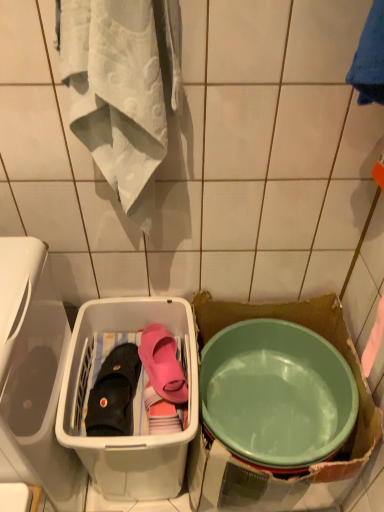
Based on the photo, what is the approximate width of green plastic bowl at lower right?

green plastic bowl at lower right is 18.17 inches wide.

What are the coordinates of `green plastic bowl at lower right` in the screenshot? It's located at (276, 394).

Locate an element on the screen. Image resolution: width=384 pixels, height=512 pixels. black fabric slipper at lower left, the 1th footwear when ordered from left to right is located at coordinates (114, 393).

Describe the element at coordinates (127, 436) in the screenshot. I see `translucent plastic basket at center` at that location.

Locate an element on the screen. The height and width of the screenshot is (512, 384). green plastic bowl at lower right is located at coordinates (276, 394).

Considering the relative sizes of translucent plastic basket at center and pink rubber slipper at center, placed as the 1th footwear when sorted from right to left, in the image provided, is translucent plastic basket at center wider than pink rubber slipper at center, placed as the 1th footwear when sorted from right to left,?

Yes.

Would you say translucent plastic basket at center is outside pink rubber slipper at center, placed as the 1th footwear when sorted from right to left?

Yes, translucent plastic basket at center is located beyond the bounds of pink rubber slipper at center, placed as the 1th footwear when sorted from right to left.

Is point (56, 435) farther from camera compared to point (170, 374)?

No, it is in front of (170, 374).

Consider the image. Is translucent plastic basket at center beside pink rubber slipper at center, which appears as the 2th footwear when viewed from the left?

There is a gap between translucent plastic basket at center and pink rubber slipper at center, which appears as the 2th footwear when viewed from the left.

Is translucent plastic basket at center surrounding black fabric slipper at lower left, positioned as the second footwear in right-to-left order?

Yes.

Would you consider translucent plastic basket at center to be distant from black fabric slipper at lower left, positioned as the second footwear in right-to-left order?

No, translucent plastic basket at center is in close proximity to black fabric slipper at lower left, positioned as the second footwear in right-to-left order.

Does point (161, 316) lie behind point (108, 424)?

Yes.

Consider the image. Which is more to the left, translucent plastic basket at center or black fabric slipper at lower left, the 1th footwear when ordered from left to right?

black fabric slipper at lower left, the 1th footwear when ordered from left to right.

Measure the distance between black fabric slipper at lower left, positioned as the second footwear in right-to-left order, and green plastic bowl at lower right.

black fabric slipper at lower left, positioned as the second footwear in right-to-left order, is 14.96 inches from green plastic bowl at lower right.

Can you confirm if black fabric slipper at lower left, positioned as the second footwear in right-to-left order, is wider than green plastic bowl at lower right?

No.

Between black fabric slipper at lower left, positioned as the second footwear in right-to-left order, and green plastic bowl at lower right, which one has larger size?

Bigger between the two is green plastic bowl at lower right.

Is black fabric slipper at lower left, the 1th footwear when ordered from left to right, at the right side of green plastic bowl at lower right?

No.

In terms of size, does green plastic bowl at lower right appear bigger or smaller than black fabric slipper at lower left, positioned as the second footwear in right-to-left order?

green plastic bowl at lower right is bigger than black fabric slipper at lower left, positioned as the second footwear in right-to-left order.

Is green plastic bowl at lower right next to black fabric slipper at lower left, positioned as the second footwear in right-to-left order, and touching it?

There is a gap between green plastic bowl at lower right and black fabric slipper at lower left, positioned as the second footwear in right-to-left order.

Measure the distance from pink rubber slipper at center, which appears as the 2th footwear when viewed from the left, to black fabric slipper at lower left, the 1th footwear when ordered from left to right.

They are 3.92 inches apart.

Would you say black fabric slipper at lower left, positioned as the second footwear in right-to-left order, is part of pink rubber slipper at center, which appears as the 2th footwear when viewed from the left,'s contents?

No, black fabric slipper at lower left, positioned as the second footwear in right-to-left order, is not inside pink rubber slipper at center, which appears as the 2th footwear when viewed from the left.

Is pink rubber slipper at center, placed as the 1th footwear when sorted from right to left, in front of black fabric slipper at lower left, the 1th footwear when ordered from left to right?

No.

Locate an element on the screen. footwear below the pink rubber slipper at center, placed as the 1th footwear when sorted from right to left (from the image's perspective) is located at coordinates (114, 393).

Between green plastic bowl at lower right and pink rubber slipper at center, which appears as the 2th footwear when viewed from the left, which one has larger size?

green plastic bowl at lower right is bigger.

Is green plastic bowl at lower right turned away from pink rubber slipper at center, which appears as the 2th footwear when viewed from the left?

No, green plastic bowl at lower right is not facing away from pink rubber slipper at center, which appears as the 2th footwear when viewed from the left.

Can you confirm if green plastic bowl at lower right is taller than pink rubber slipper at center, placed as the 1th footwear when sorted from right to left?

Yes.

The height and width of the screenshot is (512, 384). Identify the location of footwear that is the 2nd one when counting upward from the green plastic bowl at lower right (from the image's perspective). (163, 364).

Which is in front, green plastic bowl at lower right or translucent plastic basket at center?

translucent plastic basket at center.

Looking at the image, does green plastic bowl at lower right seem bigger or smaller compared to translucent plastic basket at center?

In the image, green plastic bowl at lower right appears to be smaller than translucent plastic basket at center.

Considering the sizes of green plastic bowl at lower right and translucent plastic basket at center in the image, is green plastic bowl at lower right wider or thinner than translucent plastic basket at center?

green plastic bowl at lower right is wider than translucent plastic basket at center.

Which is less distant, (305, 448) or (187, 318)?

Positioned in front is point (305, 448).

What are the coordinates of `footwear on the right side of translucent plastic basket at center` in the screenshot? It's located at (163, 364).

This screenshot has height=512, width=384. Find the location of `footwear that is the 1st one above the translucent plastic basket at center (from a real-world perspective)`. footwear that is the 1st one above the translucent plastic basket at center (from a real-world perspective) is located at coordinates (114, 393).

When comparing their distances from pink rubber slipper at center, which appears as the 2th footwear when viewed from the left, does translucent plastic basket at center or black fabric slipper at lower left, positioned as the second footwear in right-to-left order, seem further?

translucent plastic basket at center is positioned further to the anchor pink rubber slipper at center, which appears as the 2th footwear when viewed from the left.

From the image, which object appears to be farther from green plastic bowl at lower right, translucent plastic basket at center or black fabric slipper at lower left, the 1th footwear when ordered from left to right?

black fabric slipper at lower left, the 1th footwear when ordered from left to right, lies further to green plastic bowl at lower right than the other object.

Considering their positions, is black fabric slipper at lower left, the 1th footwear when ordered from left to right, positioned further to pink rubber slipper at center, which appears as the 2th footwear when viewed from the left, than translucent plastic basket at center?

translucent plastic basket at center lies further to pink rubber slipper at center, which appears as the 2th footwear when viewed from the left, than the other object.

Looking at the image, which one is located closer to pink rubber slipper at center, which appears as the 2th footwear when viewed from the left, green plastic bowl at lower right or black fabric slipper at lower left, positioned as the second footwear in right-to-left order?

black fabric slipper at lower left, positioned as the second footwear in right-to-left order.

Estimate the real-world distances between objects in this image. Which object is further from green plastic bowl at lower right, translucent plastic basket at center or pink rubber slipper at center, placed as the 1th footwear when sorted from right to left?

translucent plastic basket at center is further to green plastic bowl at lower right.

Considering their positions, is pink rubber slipper at center, placed as the 1th footwear when sorted from right to left, positioned closer to green plastic bowl at lower right than black fabric slipper at lower left, the 1th footwear when ordered from left to right?

Among the two, pink rubber slipper at center, placed as the 1th footwear when sorted from right to left, is located nearer to green plastic bowl at lower right.

Looking at the image, which one is located closer to black fabric slipper at lower left, the 1th footwear when ordered from left to right, translucent plastic basket at center or green plastic bowl at lower right?

translucent plastic basket at center.

Estimate the real-world distances between objects in this image. Which object is closer to black fabric slipper at lower left, the 1th footwear when ordered from left to right, green plastic bowl at lower right or translucent plastic basket at center?

translucent plastic basket at center is positioned closer to the anchor black fabric slipper at lower left, the 1th footwear when ordered from left to right.

This screenshot has width=384, height=512. In order to click on storage box between black fabric slipper at lower left, positioned as the second footwear in right-to-left order, and green plastic bowl at lower right in this screenshot , I will do `click(127, 436)`.

Where is `footwear located between black fabric slipper at lower left, positioned as the second footwear in right-to-left order, and green plastic bowl at lower right in the left-right direction`? footwear located between black fabric slipper at lower left, positioned as the second footwear in right-to-left order, and green plastic bowl at lower right in the left-right direction is located at coordinates (163, 364).

Where is `footwear located between translucent plastic basket at center and green plastic bowl at lower right in the left-right direction`? footwear located between translucent plastic basket at center and green plastic bowl at lower right in the left-right direction is located at coordinates (163, 364).

You are a GUI agent. You are given a task and a screenshot of the screen. Output one action in this format:
    pyautogui.click(x=<x>, y=<y>)
    Task: Click on the footwear between pink rubber slipper at center, which appears as the 2th footwear when viewed from the left, and translucent plastic basket at center from top to bottom
    
    Given the screenshot: What is the action you would take?
    pyautogui.click(x=114, y=393)